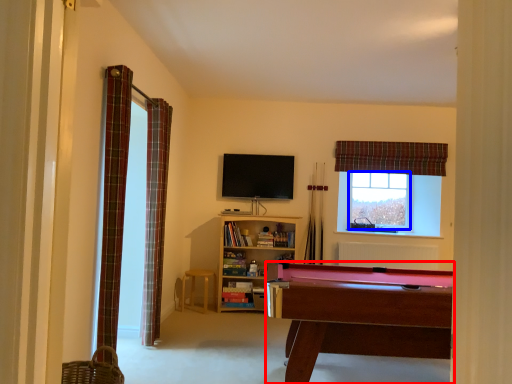
Question: Which of the following is the closest to the observer, billiard table (highlighted by a red box) or window screen (highlighted by a blue box)?

Choices:
 (A) billiard table
 (B) window screen

Answer: (A)